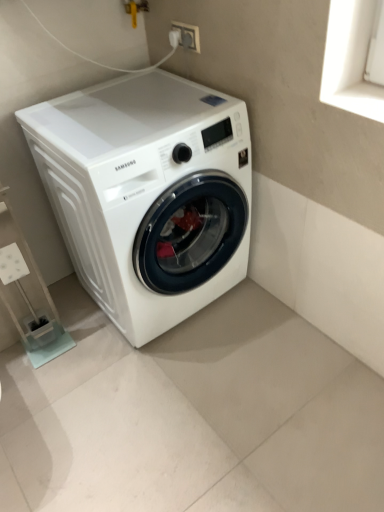
Identify the location of free location to the right of white plastic shelf at lower left. (92, 351).